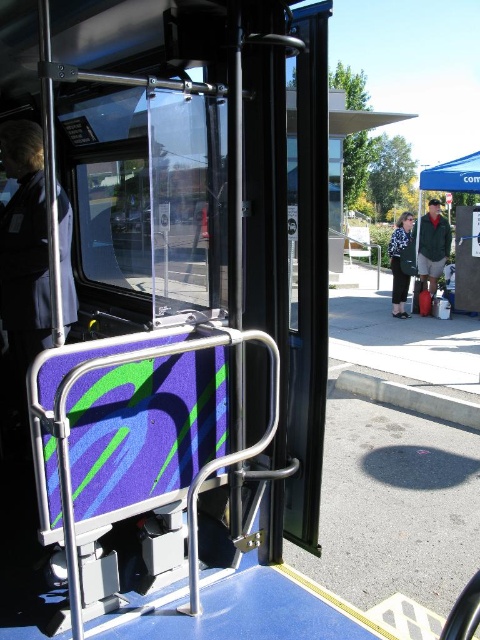
You are a passenger waiting at the bus stop. You notice the blue fabric canopy at upper right and the patterned fabric jacket at center. Which object is positioned higher relative to the other?

The blue fabric canopy at upper right is located above the patterned fabric jacket at center, so it is positioned higher.

You are a passenger waiting at the bus stop. You notice the blue fabric canopy at upper right and the patterned fabric jacket at center. Which object is taller?

The patterned fabric jacket at center is taller than the blue fabric canopy at upper right.

You are a delivery person trying to place a large box on the ground near the bus entrance. The box is 1.2 meters wide. You need to choose between placing it on the gray concrete curb at lower right or the green fabric tent at right. Based on their widths, which location can safely accommodate the box without exceeding its width?

The gray concrete curb at lower right has a larger width than the green fabric tent at right, so the gray concrete curb at lower right can safely accommodate the 1.2 meter wide box without exceeding its width.